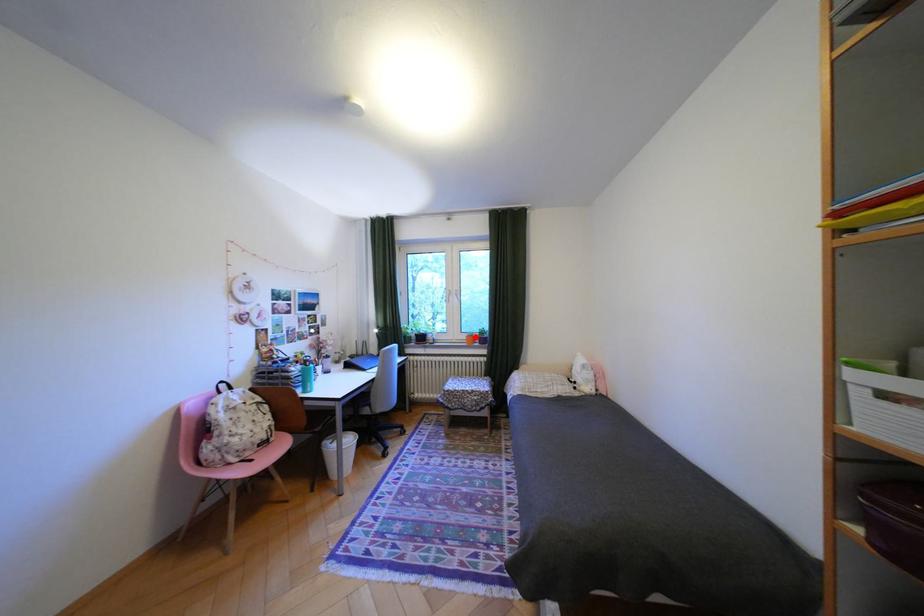
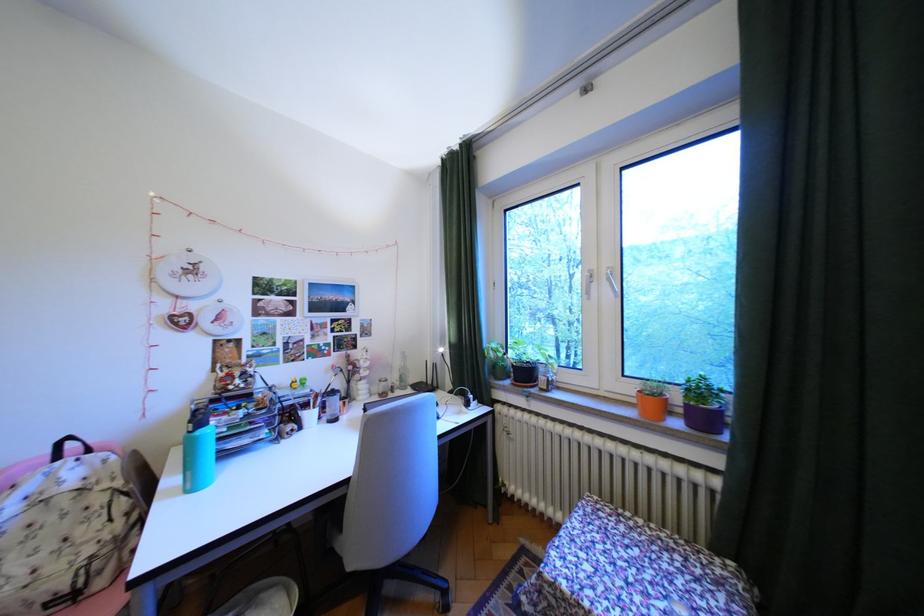
Question: I am providing you with two images of the same scene from different viewpoints. A red point is marked on the first image. Can you still see the location of the red point in image 2?

Choices:
 (A) Yes
 (B) No

Answer: (A)